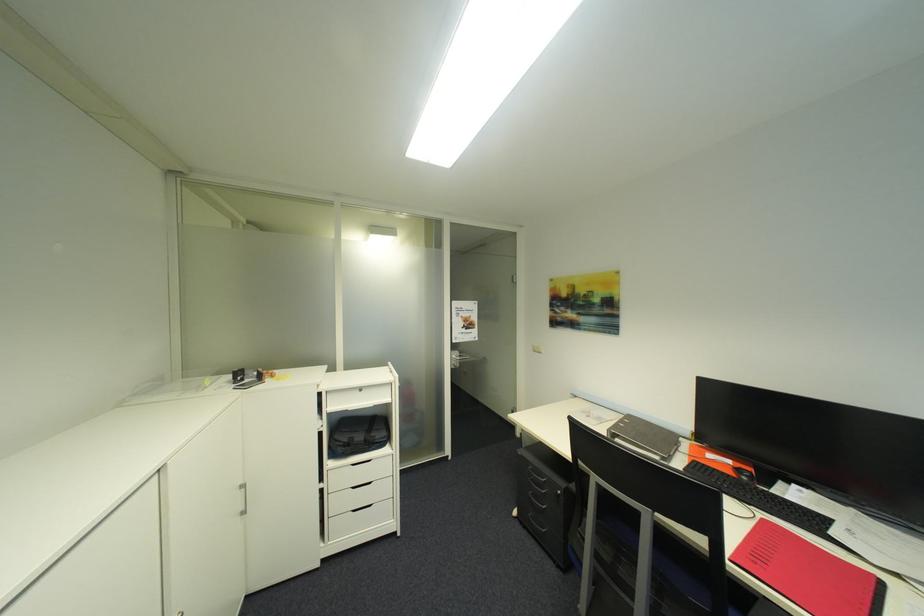
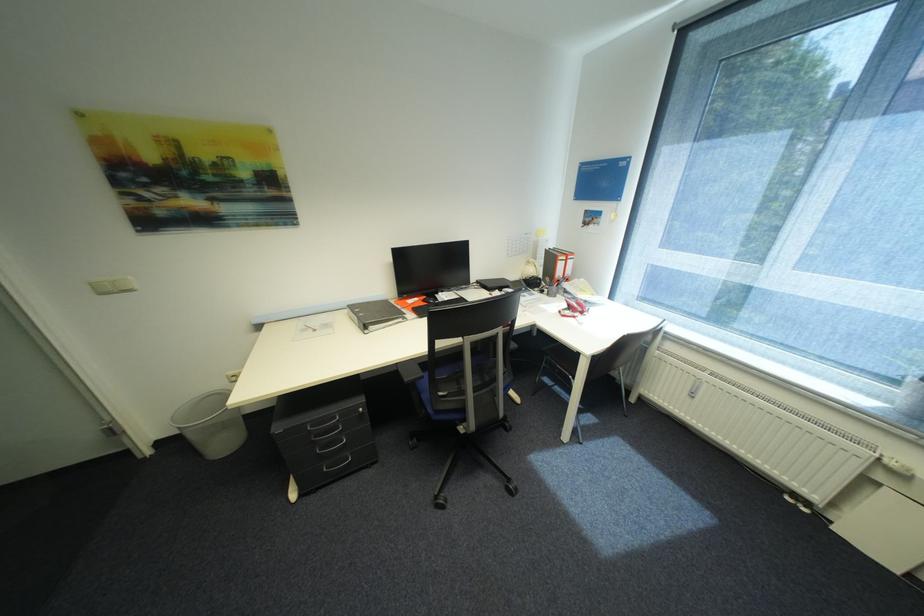
First-person continuous shooting, in which direction is the camera rotating?

The camera rotated toward right-down.